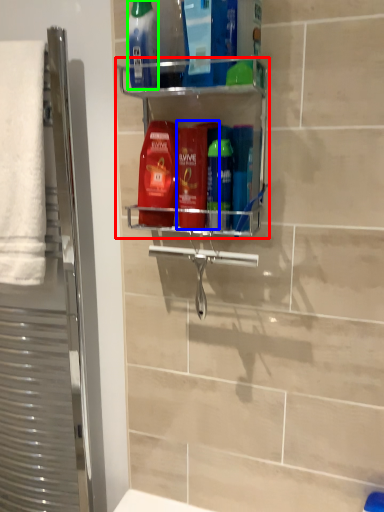
Question: Which object is positioned farthest from shelf (highlighted by a red box)? Select from mouthwash (highlighted by a blue box) and mouthwash (highlighted by a green box).

Choices:
 (A) mouthwash
 (B) mouthwash

Answer: (B)